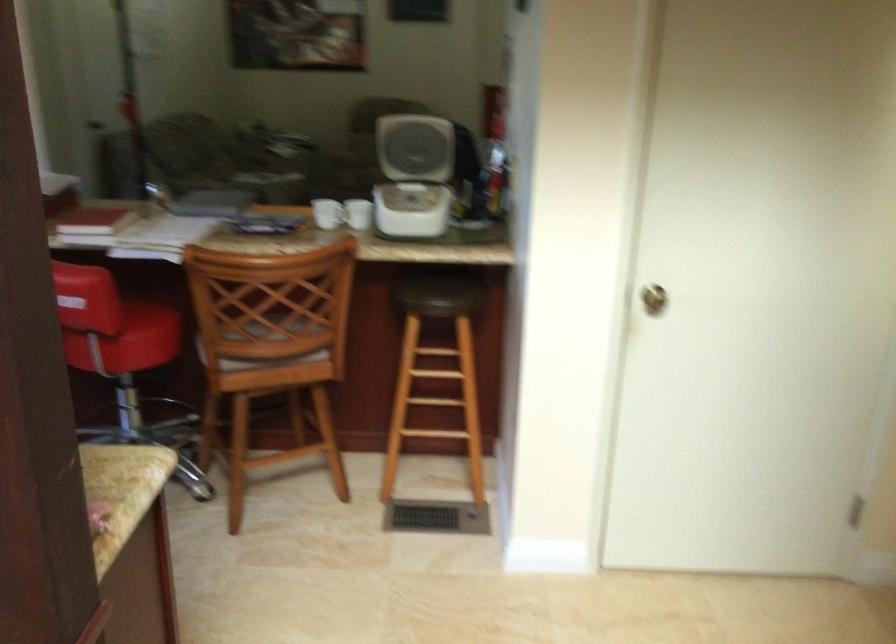
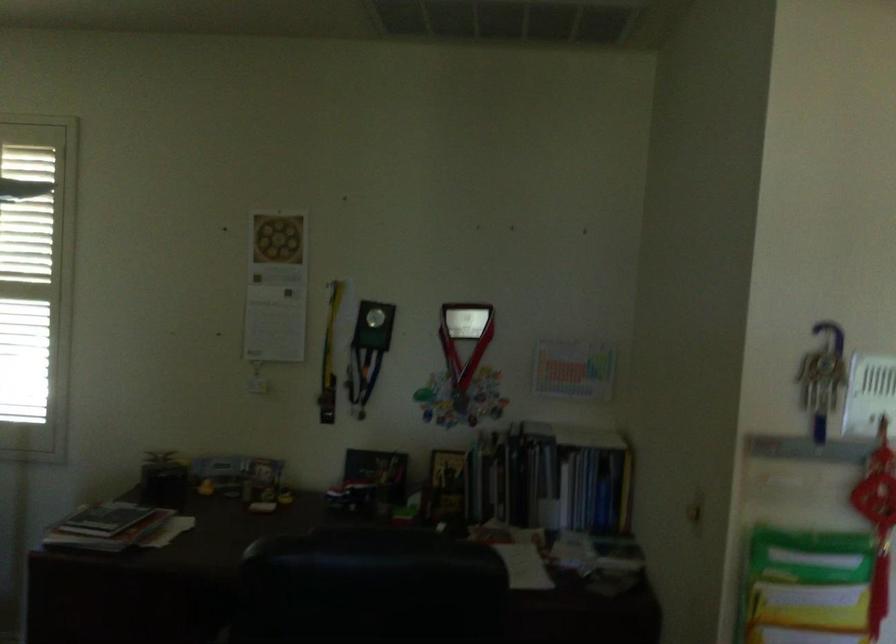
Find the pixel in the second image that matches (490,176) in the first image.

(812, 614)